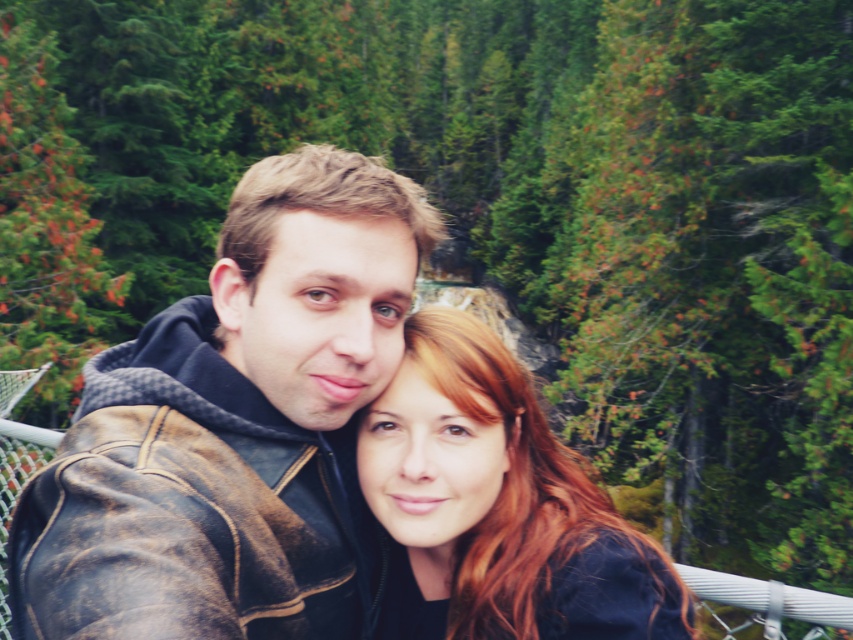
Between point (161, 468) and point (489, 372), which one is positioned behind?

The point (489, 372) is more distant.

Is point (282, 269) positioned behind point (498, 422)?

No, it is in front of (498, 422).

At what (x,y) coordinates should I click in order to perform the action: click on brown leather jacket at center. Please return your answer as a coordinate pair (x, y). Looking at the image, I should click on (234, 428).